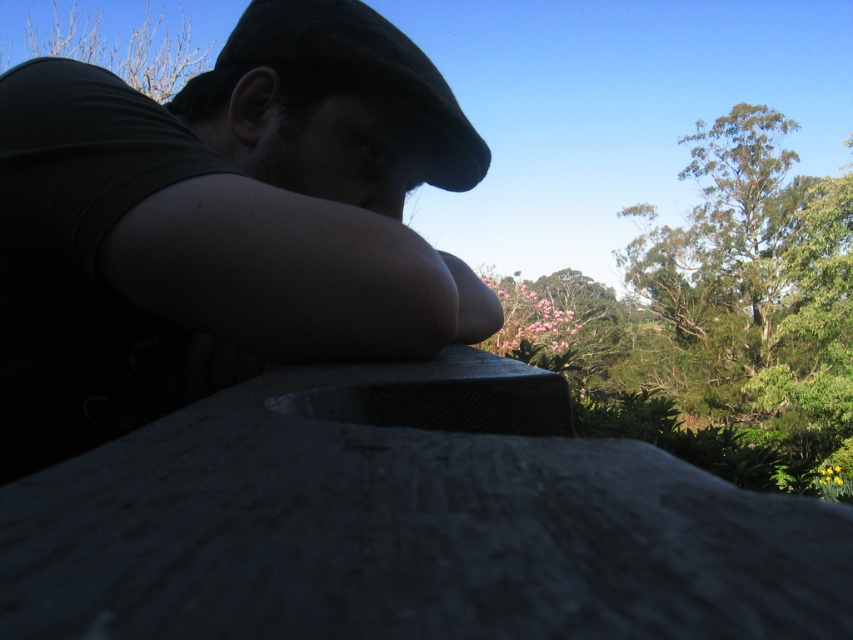
Who is higher up, green leafy tree at upper right or bare branches at upper left?

Positioned higher is bare branches at upper left.

In the scene shown: Can you confirm if green leafy tree at upper right is bigger than bare branches at upper left?

Correct, green leafy tree at upper right is larger in size than bare branches at upper left.

Between point (666, 376) and point (136, 42), which one is positioned behind?

The point (666, 376) is behind.

Locate an element on the screen. The width and height of the screenshot is (853, 640). green leafy tree at upper right is located at coordinates (717, 320).

Can you confirm if matte black cap at upper center is taller than bare branches at upper left?

In fact, matte black cap at upper center may be shorter than bare branches at upper left.

Based on the photo, is matte black cap at upper center to the right of bare branches at upper left from the viewer's perspective?

Indeed, matte black cap at upper center is positioned on the right side of bare branches at upper left.

Is point (219, 346) less distant than point (186, 19)?

Yes, point (219, 346) is closer to viewer.

Where is `matte black cap at upper center`? matte black cap at upper center is located at coordinates (222, 225).

Is point (496, 310) less distant than point (334, 22)?

That is False.

Between point (144, 388) and point (347, 10), which one is positioned in front?

Positioned in front is point (144, 388).

This screenshot has width=853, height=640. Find the location of `matte black cap at upper center`. matte black cap at upper center is located at coordinates (222, 225).